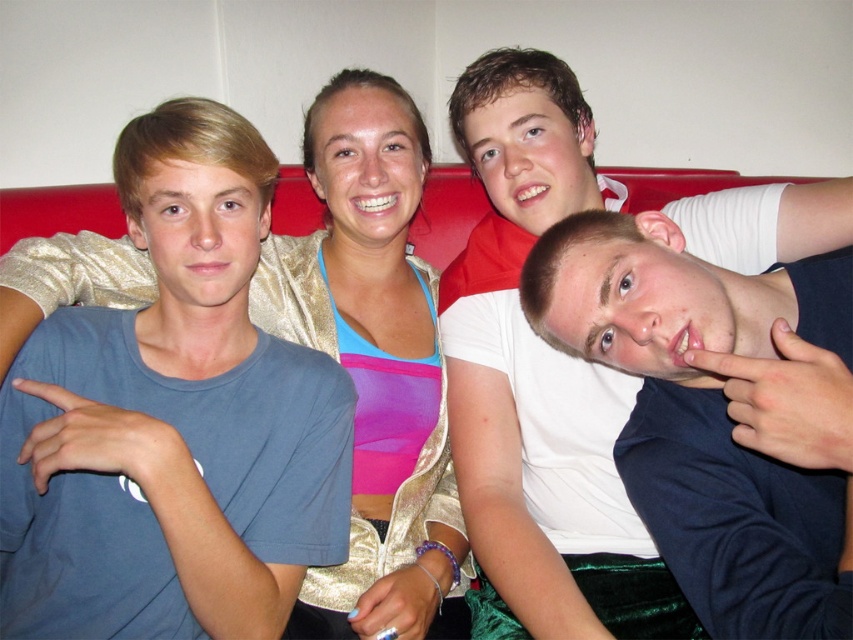
You are standing in front of a group of people sitting on a red couch. You need to hand a gift to the person wearing the gold shimmering jacket at center. Which direction should you move to reach them first without passing the white cotton shirt at right?

The white cotton shirt at right is positioned on the right side of the gold shimmering jacket at center, so you should move to the left to reach the gold shimmering jacket at center first without passing the white cotton shirt at right.

You are standing in front of the couch and want to place a 6.5 inch wide decorative pillow between the white cotton shirt at right and the gold shimmering jacket at center. Will the pillow fit comfortably between them?

The distance between the white cotton shirt at right and the gold shimmering jacket at center is 7.08 inches. Since the pillow is 6.5 inches wide, it will fit comfortably between them with a little space to spare.

You are standing in front of the couch. The point at coordinates (631, 577) is where you want to place a small gift. If your hand is 1 meter away from the couch, will you be able to reach the point?

The point at coordinates (631, 577) is 1.04 meters from the camera. Since your hand is 1 meter away from the couch, you are 0.04 meters too short to reach the point.